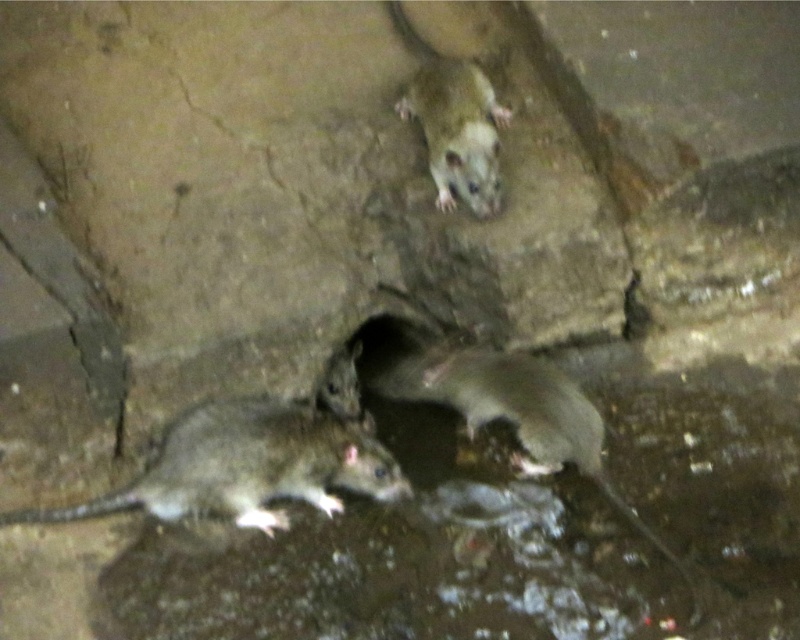
Who is more distant from viewer, (x=256, y=483) or (x=714, y=600)?

Point (x=256, y=483)

Is point (248, 438) in front of point (608, 486)?

Yes, point (248, 438) is in front of point (608, 486).

Who is more forward, (258, 488) or (546, 372)?

Point (258, 488) is in front.

The width and height of the screenshot is (800, 640). In order to click on gray matte mouse at lower left in this screenshot , I will do `click(249, 467)`.

Can you confirm if gray fur mouse at lower center is taller than fuzzy gray mouse at upper center?

Yes, gray fur mouse at lower center is taller than fuzzy gray mouse at upper center.

What do you see at coordinates (524, 420) in the screenshot?
I see `gray fur mouse at lower center` at bounding box center [524, 420].

The image size is (800, 640). I want to click on gray fur mouse at lower center, so click(524, 420).

Does gray matte mouse at lower left have a greater height compared to fuzzy gray mouse at upper center?

No, gray matte mouse at lower left is not taller than fuzzy gray mouse at upper center.

Is gray matte mouse at lower left behind fuzzy gray mouse at upper center?

No.

This screenshot has height=640, width=800. What do you see at coordinates (249, 467) in the screenshot?
I see `gray matte mouse at lower left` at bounding box center [249, 467].

This screenshot has width=800, height=640. What are the coordinates of `gray matte mouse at lower left` in the screenshot? It's located at (249, 467).